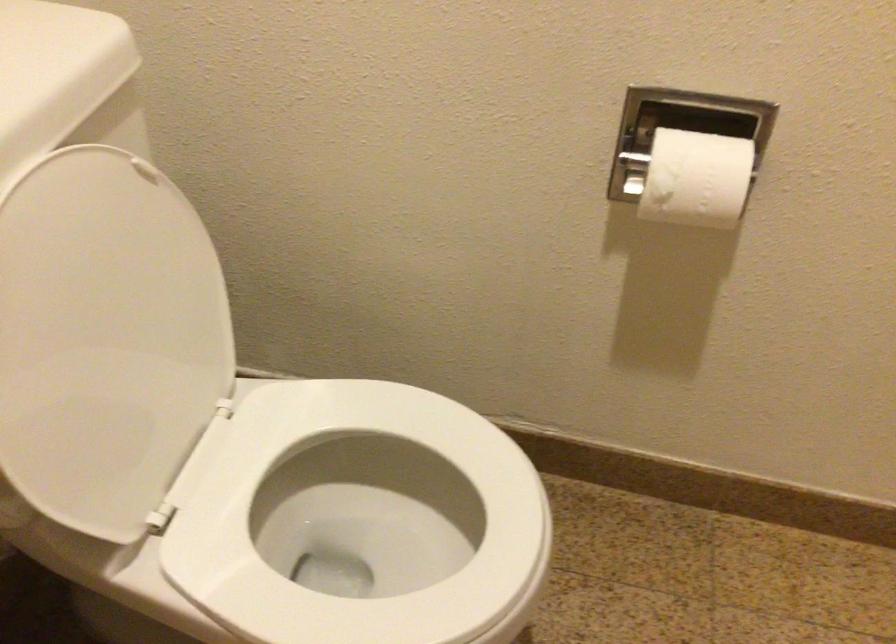
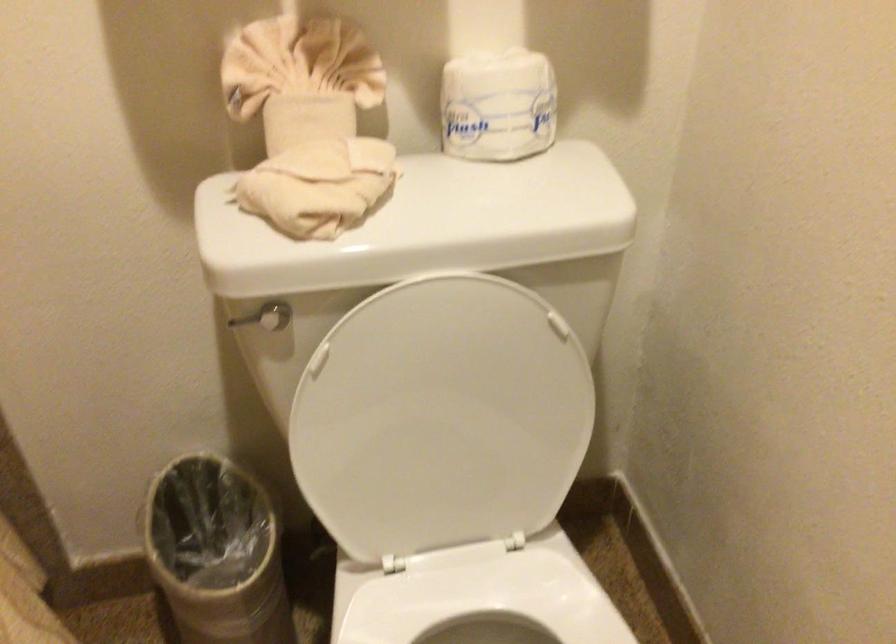
Question: How did the camera likely rotate?

Choices:
 (A) Left
 (B) Right
 (C) Up
 (D) Down

Answer: (A)